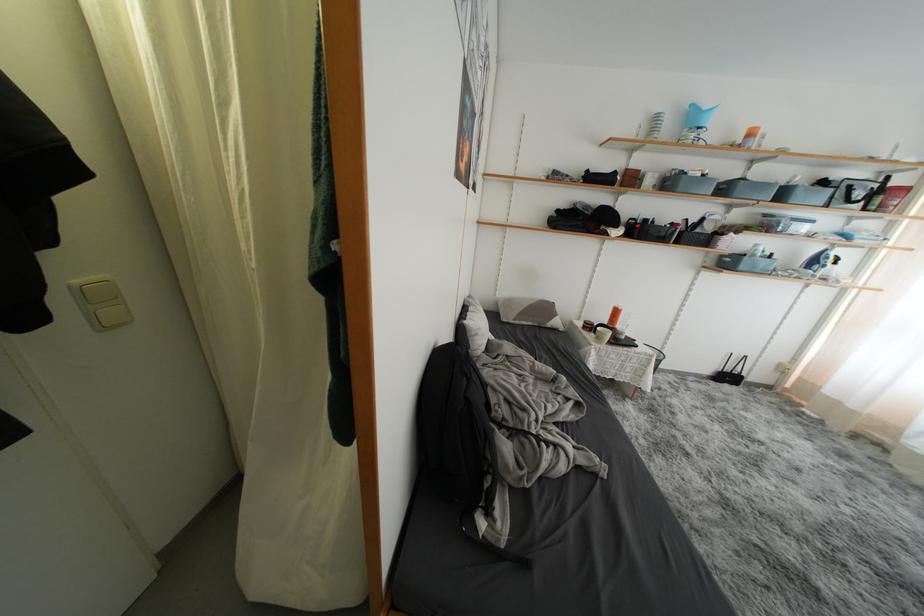
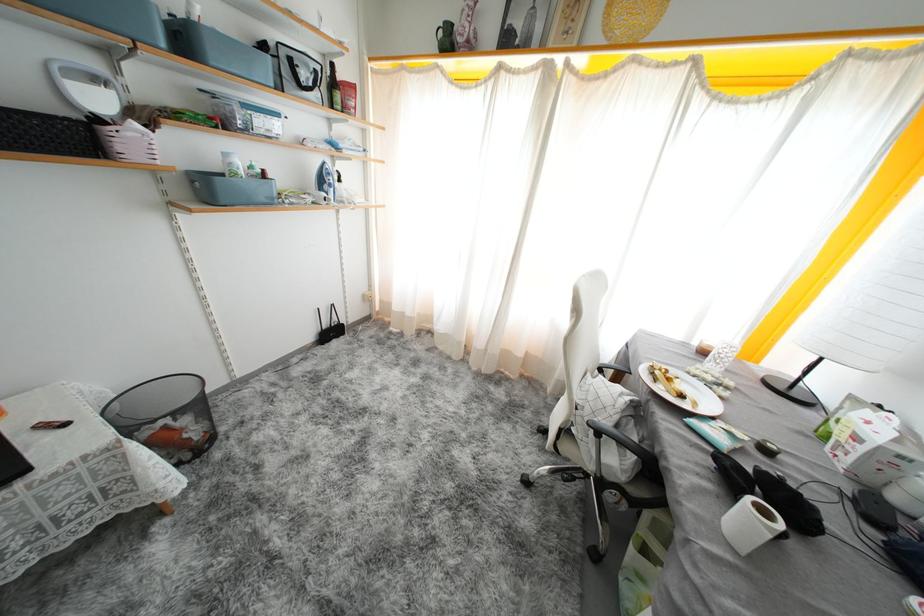
In the second image, find the point that corresponds to [716,220] in the first image.

(103, 84)